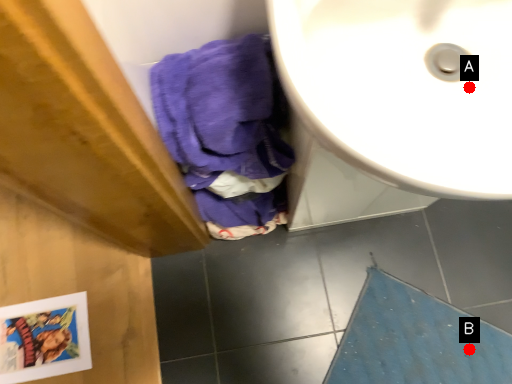
Question: Two points are circled on the image, labeled by A and B beside each circle. Which point is further to the camera?

Choices:
 (A) A is further
 (B) B is further

Answer: (B)